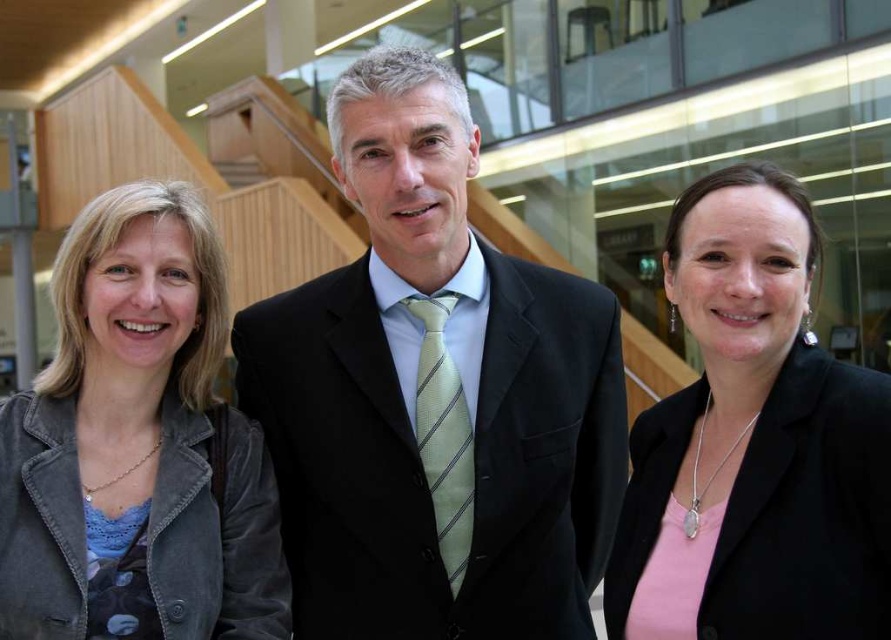
Is black suit at center to the left of pink matte blazer at center from the viewer's perspective?

Correct, you'll find black suit at center to the left of pink matte blazer at center.

Who is shorter, black suit at center or pink matte blazer at center?

pink matte blazer at center

What do you see at coordinates (434, 396) in the screenshot?
I see `black suit at center` at bounding box center [434, 396].

Find the location of a particular element. The height and width of the screenshot is (640, 891). black suit at center is located at coordinates (434, 396).

Is denim jacket at left bigger than pink matte blazer at center?

Correct, denim jacket at left is larger in size than pink matte blazer at center.

Consider the image. Does denim jacket at left have a lesser width compared to pink matte blazer at center?

No, denim jacket at left is not thinner than pink matte blazer at center.

The image size is (891, 640). I want to click on denim jacket at left, so click(136, 445).

Does black suit at center appear on the left side of denim jacket at left?

No, black suit at center is not to the left of denim jacket at left.

Between black suit at center and denim jacket at left, which one has less height?

denim jacket at left is shorter.

Between point (426, 348) and point (63, 593), which one is positioned behind?

Positioned behind is point (426, 348).

The width and height of the screenshot is (891, 640). In order to click on black suit at center in this screenshot , I will do `click(434, 396)`.